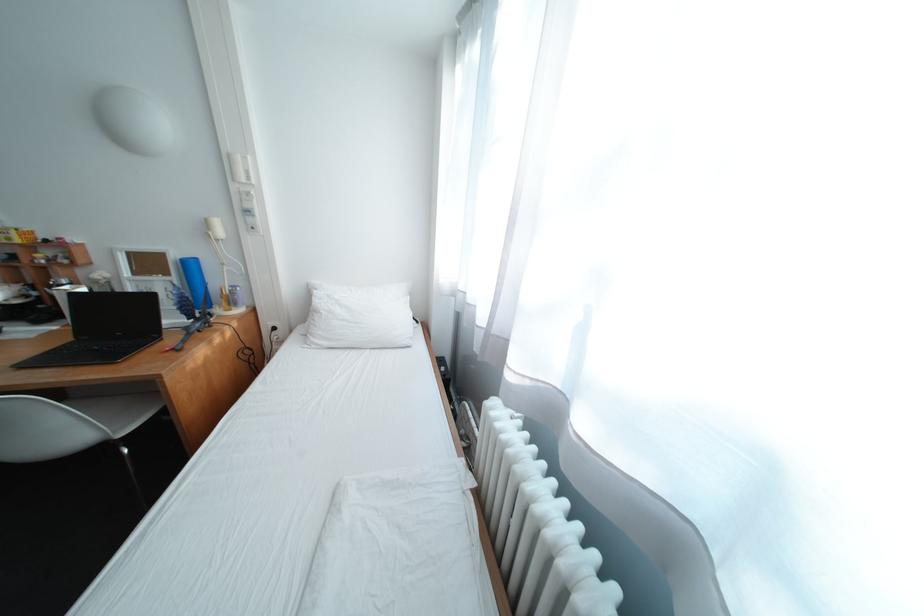
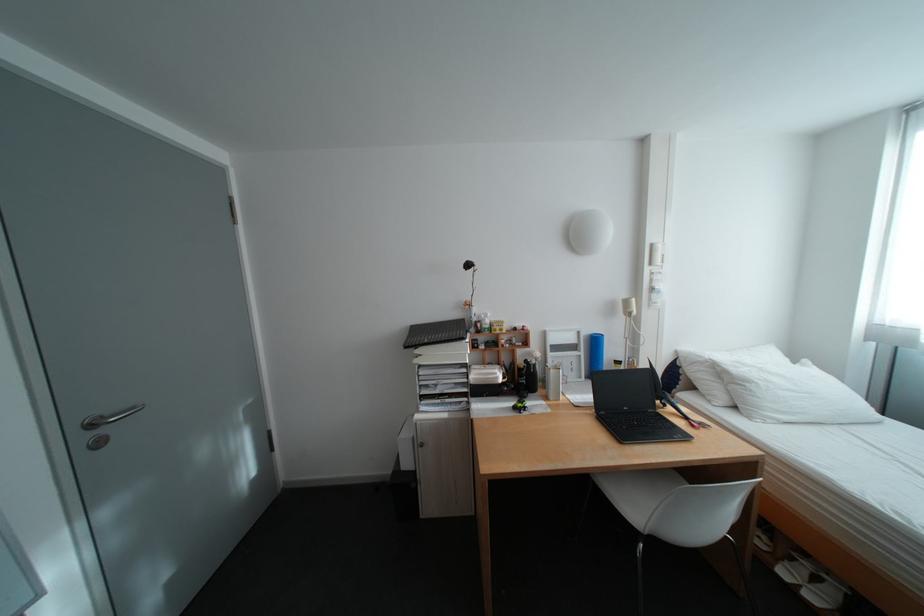
In the second image, find the point that corresponds to [330,314] in the first image.

(761, 384)